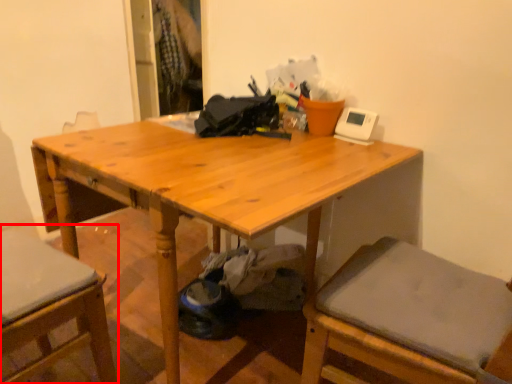
Question: From the image's perspective, where is chair (annotated by the red box) located in relation to table in the image?

Choices:
 (A) below
 (B) above

Answer: (A)